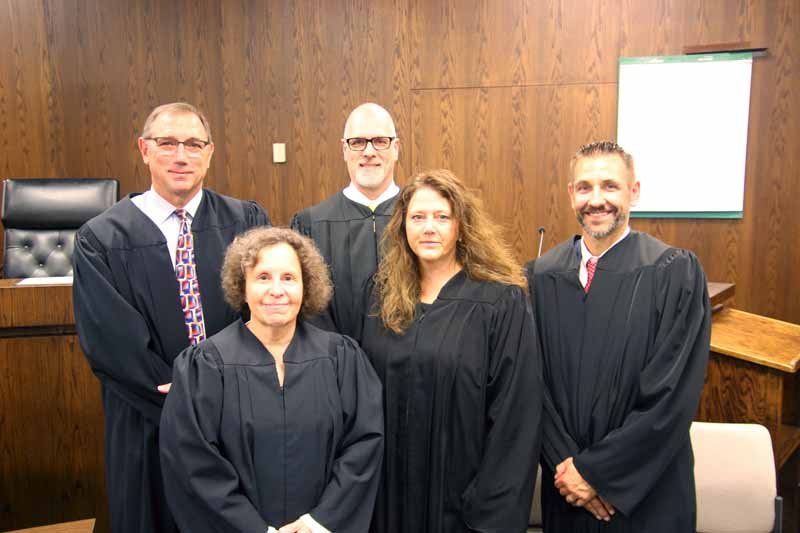
Identify the location of blank paper. The width and height of the screenshot is (800, 533). (701, 140).